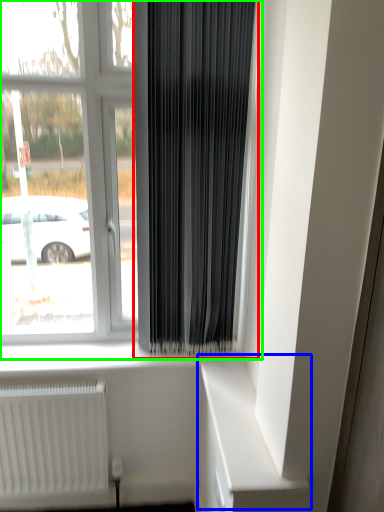
Question: Considering the real-world distances, which object is farthest from curtain (highlighted by a red box)? shelf (highlighted by a blue box) or window (highlighted by a green box)?

Choices:
 (A) shelf
 (B) window

Answer: (A)